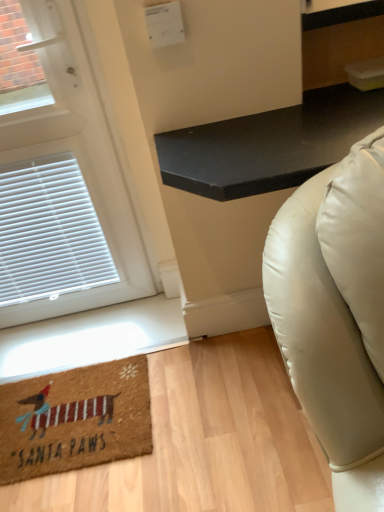
Where is `free space above brown coir mat at lower left (from a real-world perspective)`? This screenshot has height=512, width=384. free space above brown coir mat at lower left (from a real-world perspective) is located at coordinates (71, 409).